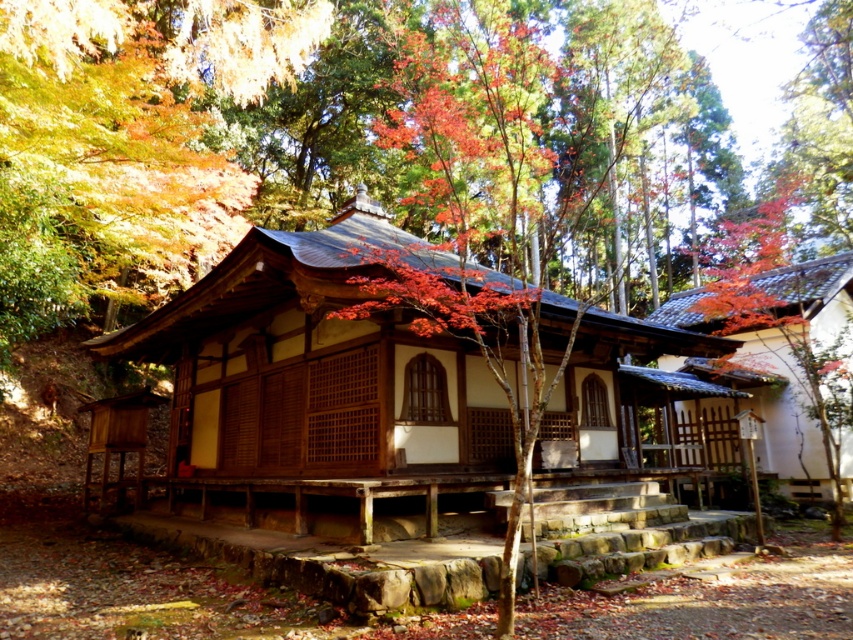
Locate an element on the screen. This screenshot has width=853, height=640. wooden hut at center is located at coordinates (318, 392).